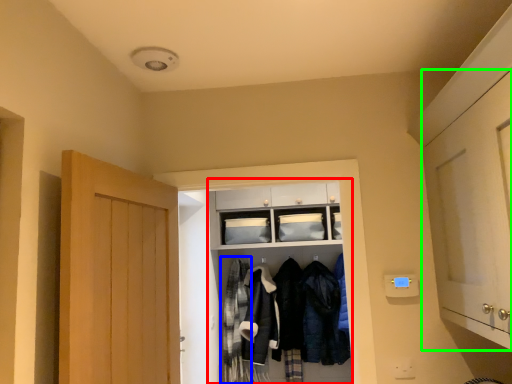
Question: Estimate the real-world distances between objects in this image. Which object is farther from closet (highlighted by a red box), clothing (highlighted by a blue box) or door (highlighted by a green box)?

Choices:
 (A) clothing
 (B) door

Answer: (B)